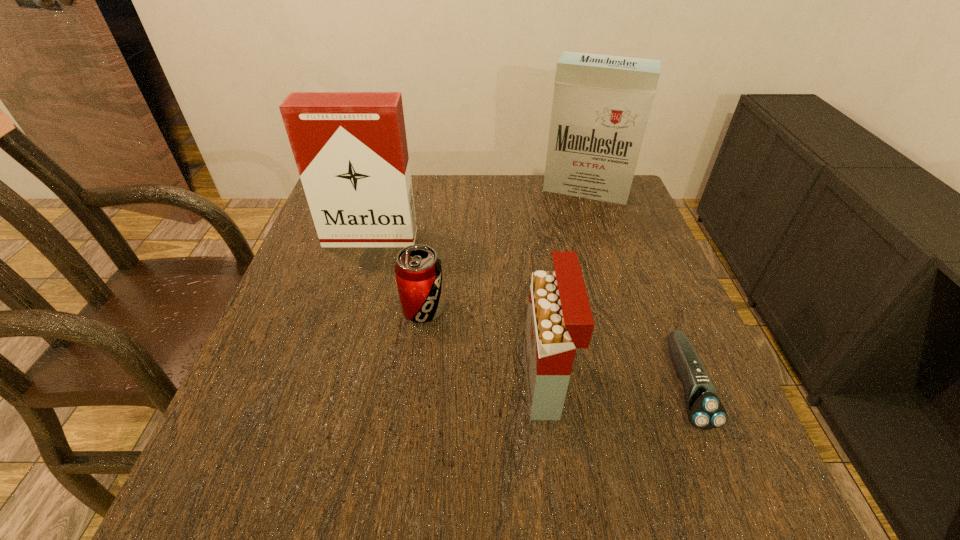
Identify the location of object that is at the far right corner. The image size is (960, 540). (601, 104).

At what (x,y) coordinates should I click in order to perform the action: click on free space at the far edge of the desktop. Please return your answer as a coordinate pair (x, y). The height and width of the screenshot is (540, 960). Looking at the image, I should click on (508, 180).

The height and width of the screenshot is (540, 960). In the image, there is a desktop. Find the location of `vacant space at the near edge`. vacant space at the near edge is located at coordinates (364, 461).

The image size is (960, 540). I want to click on free space at the left edge, so click(x=275, y=407).

This screenshot has height=540, width=960. Find the location of `vacant region at the right edge`. vacant region at the right edge is located at coordinates (604, 234).

Locate an element on the screen. This screenshot has height=540, width=960. free spot between the shortest object and the second cigarette case from right to left is located at coordinates (615, 384).

This screenshot has height=540, width=960. In order to click on vacant space that's between the farthest object and the leftmost cigarette case in this screenshot , I will do `click(478, 214)`.

At what (x,y) coordinates should I click in order to perform the action: click on free area in between the second farthest cigarette case and the third shortest object. Please return your answer as a coordinate pair (x, y). The height and width of the screenshot is (540, 960). Looking at the image, I should click on (458, 310).

Where is `vacant area between the rightmost cigarette case and the second shortest object`? vacant area between the rightmost cigarette case and the second shortest object is located at coordinates (505, 249).

I want to click on the closest object to the second cigarette case from right to left, so click(x=418, y=270).